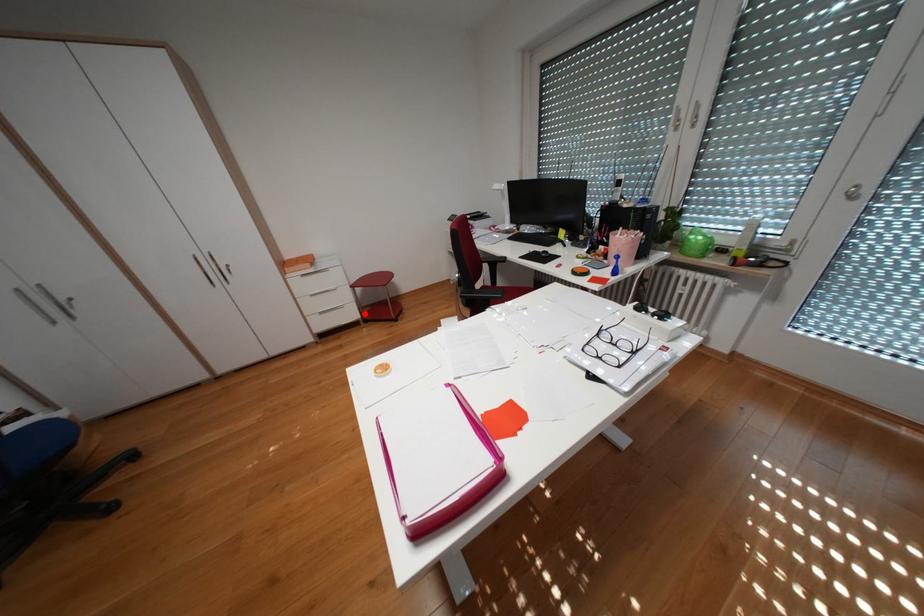
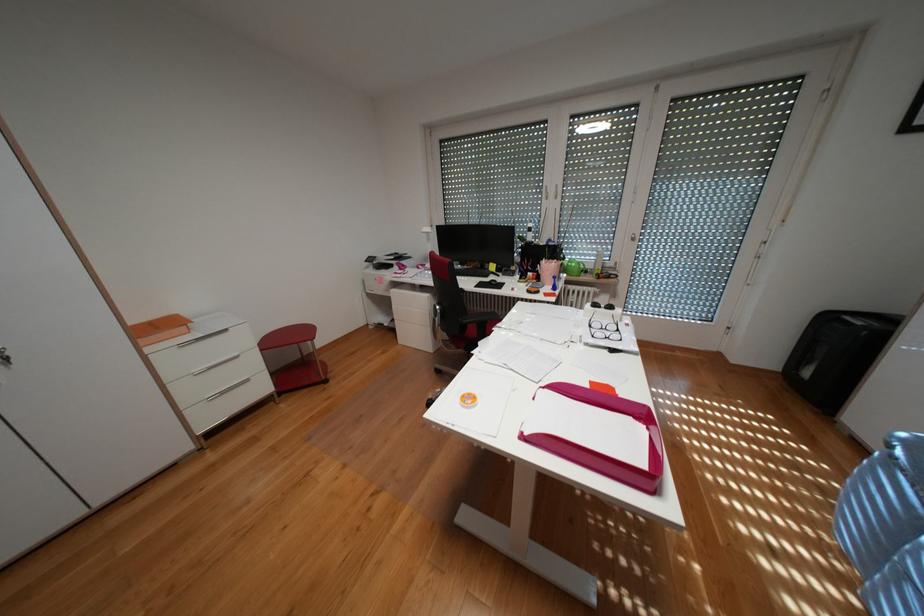
Question: I am providing you with two images of the same scene from different viewpoints. A red point is marked on the first image. At the location where the point appears in image 1, is it still visible in image 2?

Choices:
 (A) Yes
 (B) No

Answer: (A)